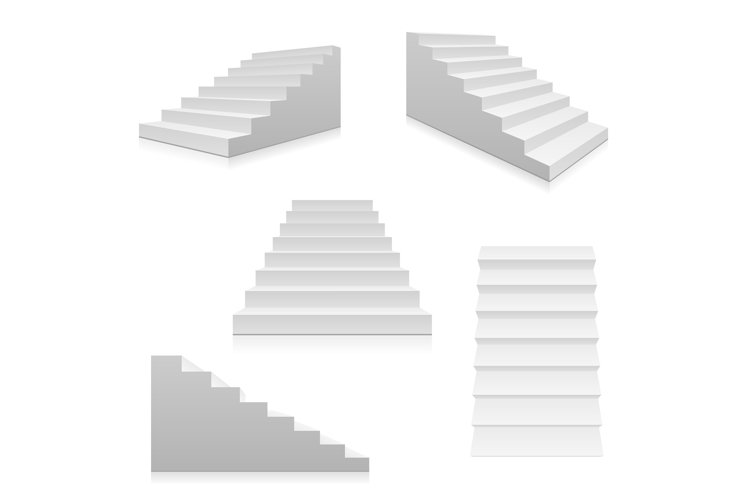
Where is `staircases`? The height and width of the screenshot is (500, 750). staircases is located at coordinates (236, 424), (514, 369), (351, 272), (262, 92), (486, 94).